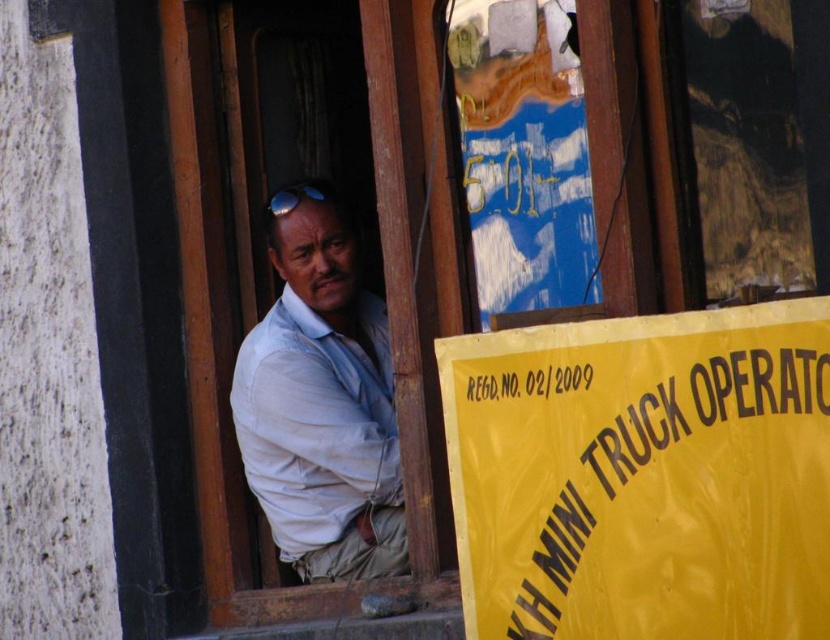
Looking at this image, can you confirm if yellow paper sign at lower right is positioned to the right of blue reflective lens at upper center?

Yes, yellow paper sign at lower right is to the right of blue reflective lens at upper center.

Does point (760, 604) come farther from viewer compared to point (316, 200)?

No, it is in front of (316, 200).

Identify the location of yellow paper sign at lower right. (643, 476).

Can you confirm if light blue shirt at center is taller than blue reflective lens at upper center?

Indeed, light blue shirt at center has a greater height compared to blue reflective lens at upper center.

Between light blue shirt at center and blue reflective lens at upper center, which one has less height?

blue reflective lens at upper center is shorter.

This screenshot has height=640, width=830. What do you see at coordinates (321, 406) in the screenshot?
I see `light blue shirt at center` at bounding box center [321, 406].

Find the location of `light blue shirt at center`. light blue shirt at center is located at coordinates (321, 406).

Between yellow paper sign at lower right and light blue shirt at center, which one is positioned lower?

Positioned lower is yellow paper sign at lower right.

At what (x,y) coordinates should I click in order to perform the action: click on yellow paper sign at lower right. Please return your answer as a coordinate pair (x, y). The height and width of the screenshot is (640, 830). Looking at the image, I should click on (643, 476).